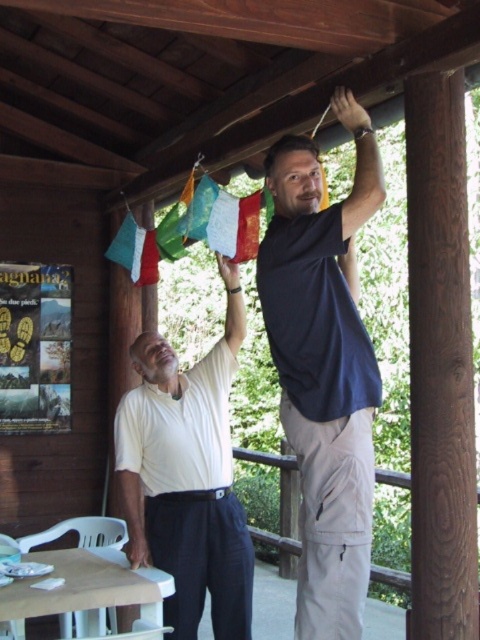
In the scene shown: You are standing in front of the wooden structure where two men are hanging flags. There are two points marked in the image. Which point, point (288, 397) or point (143, 394), is closer to you?

Point (288, 397) is closer to the viewer than point (143, 394).